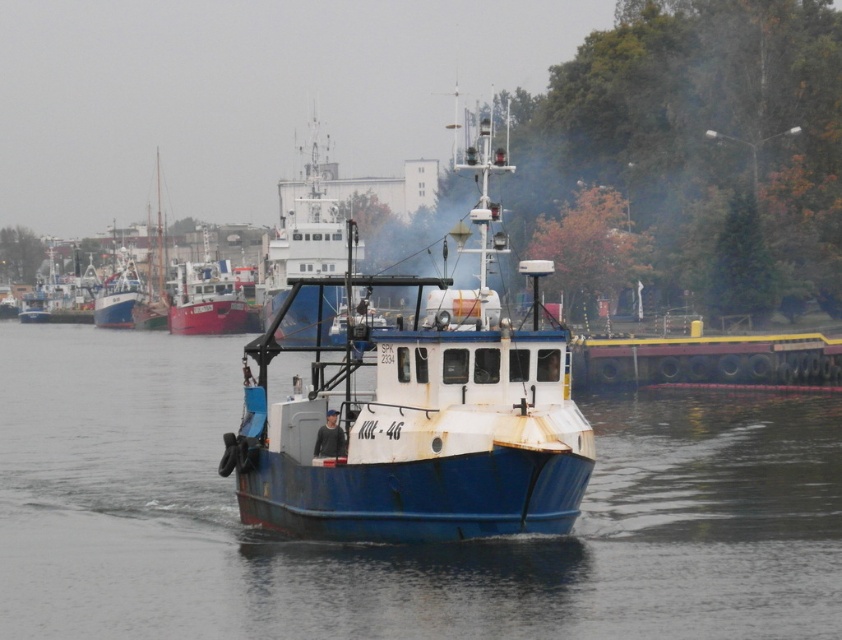
You are a photographer planning to take a photo of the blue metallic boat at center and the rustic wooden ship at center. Which of the two boats should you focus on if you want to highlight the taller vessel in your composition?

The rustic wooden ship at center is taller than the blue metallic boat at center, so you should focus on the rustic wooden ship at center to highlight the taller vessel in your composition.

Looking at this image, you are a sailor who needs to board the blue metallic boat at center. From your current position near the rusty metal boat at left, which direction should you move to reach it?

The blue metallic boat at center is to the right of the rusty metal boat at left, so you should move to the right to reach it.

You are planning to dock your new boat which is 10 meters wide. You see the rustic wooden ship at center and the rusty metal boat at left. Which existing boat has a width that your new boat can fit between them?

The rustic wooden ship at center has a lesser width compared to rusty metal boat at left, so your new boat which is 10 meters wide can fit between them if the distance between the two boats is at least 10 meters. However, the exact feasibility depends on the actual spacing between the rustic wooden ship at center and rusty metal boat at left.